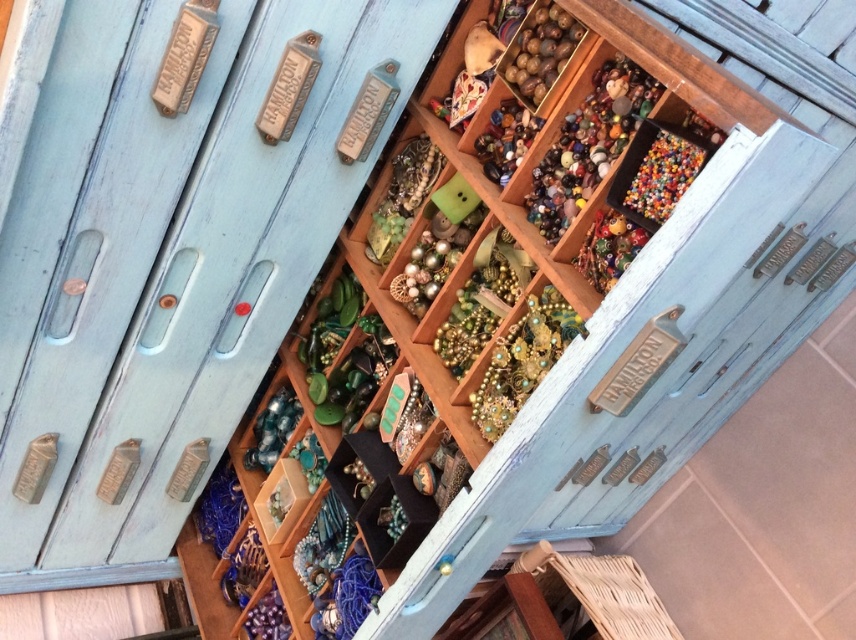
Question: Can you confirm if wooden jewelry box at center is positioned above translucent glass beads at center?

Choices:
 (A) yes
 (B) no

Answer: (B)

Question: Which point appears farthest from the camera in this image?

Choices:
 (A) (24, 220)
 (B) (625, 68)

Answer: (A)

Question: Among these points, which one is nearest to the camera?

Choices:
 (A) (584, 189)
 (B) (91, 72)

Answer: (B)

Question: Does wooden jewelry box at center appear under translucent glass beads at center?

Choices:
 (A) no
 (B) yes

Answer: (B)

Question: Which object is farther from the camera taking this photo?

Choices:
 (A) wooden jewelry box at center
 (B) translucent glass beads at center

Answer: (B)

Question: Where is wooden jewelry box at center located in relation to translucent glass beads at center in the image?

Choices:
 (A) above
 (B) below

Answer: (B)